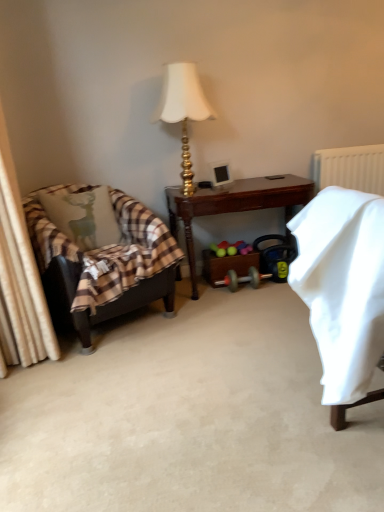
Question: From the image's perspective, relative to white plastic radiator at upper right, is light green fabric pillow with deer print at left above or below?

Choices:
 (A) below
 (B) above

Answer: (A)

Question: Considering the positions of point (82, 243) and point (347, 181), is point (82, 243) closer or farther from the camera than point (347, 181)?

Choices:
 (A) farther
 (B) closer

Answer: (B)

Question: Which of these objects is positioned farthest from the leather armchair at left?

Choices:
 (A) light green fabric pillow with deer print at left
 (B) white soft blanket at right
 (C) brown wooden desk at center
 (D) white plastic radiator at upper right
 (E) gold metallic lamp at upper center

Answer: (D)

Question: Estimate the real-world distances between objects in this image. Which object is farther from the brown wooden desk at center?

Choices:
 (A) light green fabric pillow with deer print at left
 (B) leather armchair at left
 (C) white soft blanket at right
 (D) white plastic radiator at upper right
 (E) gold metallic lamp at upper center

Answer: (C)